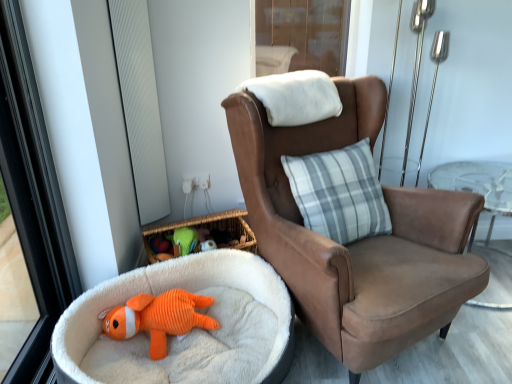
Question: Is transparent glass screen door at upper center not within brown suede chair at center?

Choices:
 (A) yes
 (B) no

Answer: (A)

Question: Is transparent glass screen door at upper center bigger than brown suede chair at center?

Choices:
 (A) no
 (B) yes

Answer: (A)

Question: Considering the relative sizes of transparent glass screen door at upper center and brown suede chair at center in the image provided, is transparent glass screen door at upper center thinner than brown suede chair at center?

Choices:
 (A) no
 (B) yes

Answer: (B)

Question: Are transparent glass screen door at upper center and brown suede chair at center far apart?

Choices:
 (A) no
 (B) yes

Answer: (B)

Question: From the image's perspective, is transparent glass screen door at upper center below brown suede chair at center?

Choices:
 (A) yes
 (B) no

Answer: (B)

Question: From the image's perspective, is orange corduroy dog bed at lower left located above or below brown suede chair at center?

Choices:
 (A) below
 (B) above

Answer: (A)

Question: From a real-world perspective, is orange corduroy dog bed at lower left above or below brown suede chair at center?

Choices:
 (A) below
 (B) above

Answer: (A)

Question: Is orange corduroy dog bed at lower left inside or outside of brown suede chair at center?

Choices:
 (A) inside
 (B) outside

Answer: (B)

Question: Considering the positions of orange corduroy dog bed at lower left and brown suede chair at center in the image, is orange corduroy dog bed at lower left wider or thinner than brown suede chair at center?

Choices:
 (A) thin
 (B) wide

Answer: (A)

Question: In the image, is brown suede chair at center positioned in front of or behind white textured window screen at left?

Choices:
 (A) front
 (B) behind

Answer: (A)

Question: Based on their positions, is brown suede chair at center located to the left or right of white textured window screen at left?

Choices:
 (A) right
 (B) left

Answer: (A)

Question: From a real-world perspective, is brown suede chair at center physically located above or below white textured window screen at left?

Choices:
 (A) above
 (B) below

Answer: (B)

Question: Is brown suede chair at center inside or outside of white textured window screen at left?

Choices:
 (A) outside
 (B) inside

Answer: (A)

Question: Choose the correct answer: Is transparent glass screen door at upper center inside orange corduroy dog bed at lower left or outside it?

Choices:
 (A) outside
 (B) inside

Answer: (A)

Question: Considering the positions of point (323, 19) and point (154, 279), is point (323, 19) closer or farther from the camera than point (154, 279)?

Choices:
 (A) closer
 (B) farther

Answer: (B)